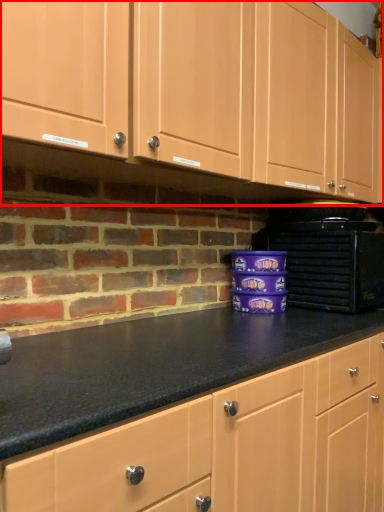
Question: From the image's perspective, what is the correct spatial positioning of cabinetry (annotated by the red box) in reference to home appliance?

Choices:
 (A) below
 (B) above

Answer: (B)